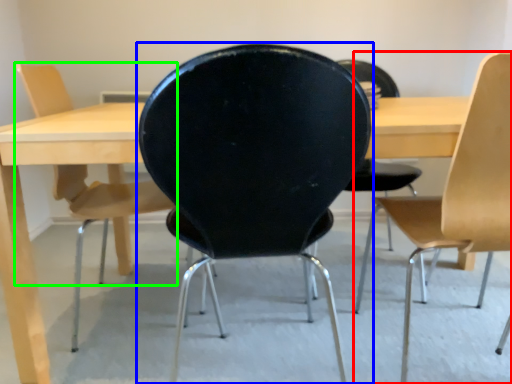
Question: Based on their relative distances, which object is nearer to chair (highlighted by a red box)? Choose from chair (highlighted by a blue box) and chair (highlighted by a green box).

Choices:
 (A) chair
 (B) chair

Answer: (A)